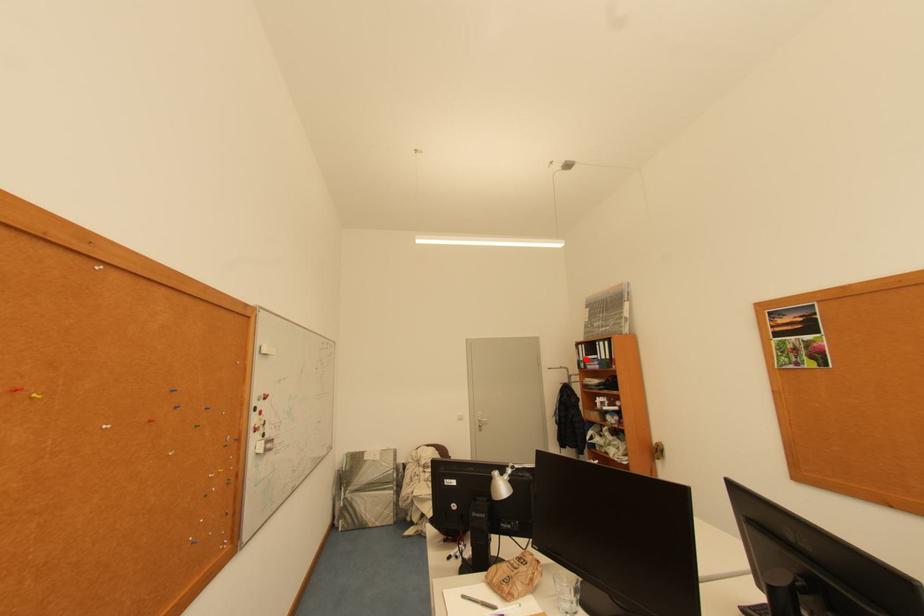
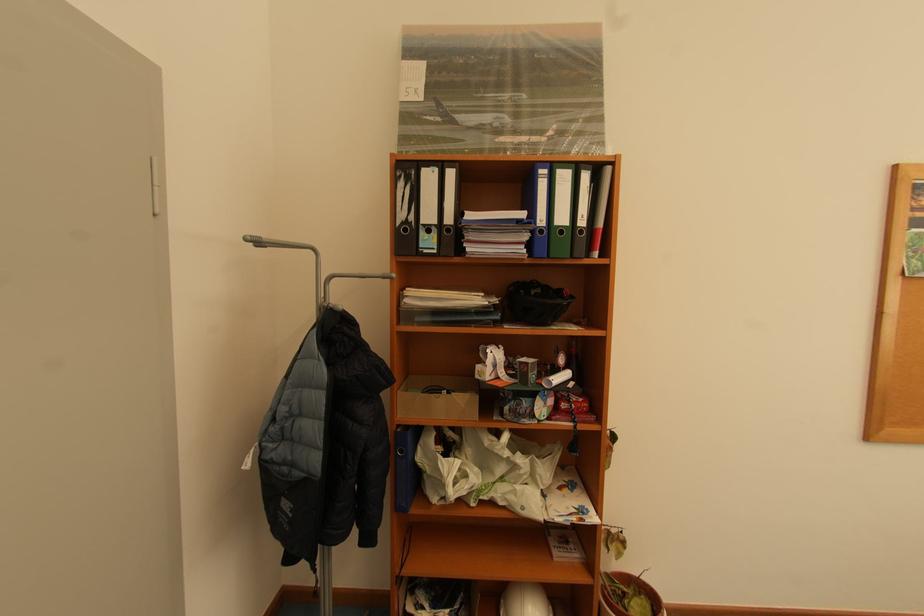
Find the pixel in the second image that matches the highlighted location in the first image.

(409, 217)